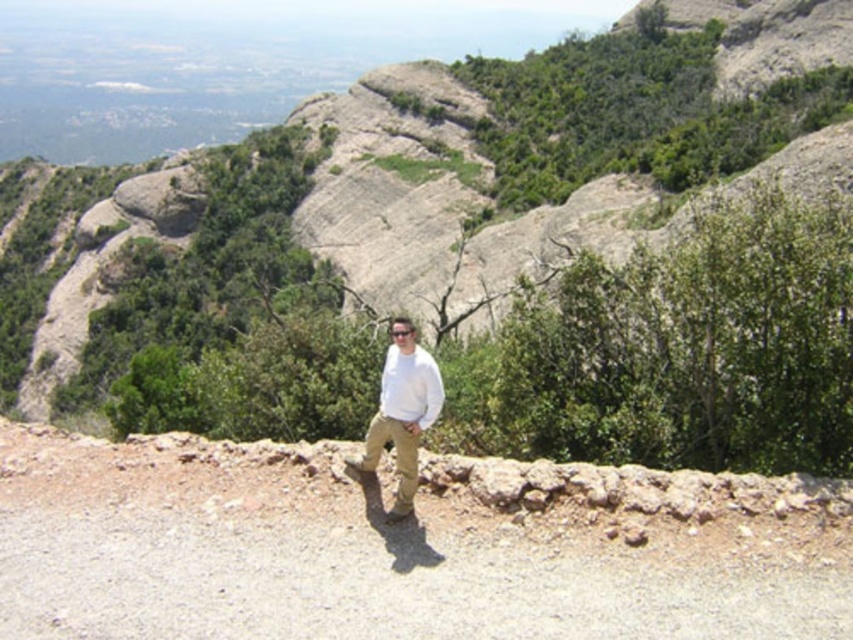
Who is positioned more to the right, gray rock formation at center or white cotton shirt at center?

white cotton shirt at center is more to the right.

Is point (511, 216) farther from camera compared to point (415, 394)?

Yes, it is.

This screenshot has height=640, width=853. Describe the element at coordinates (418, 189) in the screenshot. I see `gray rock formation at center` at that location.

Locate an element on the screen. The image size is (853, 640). gray rock formation at center is located at coordinates (418, 189).